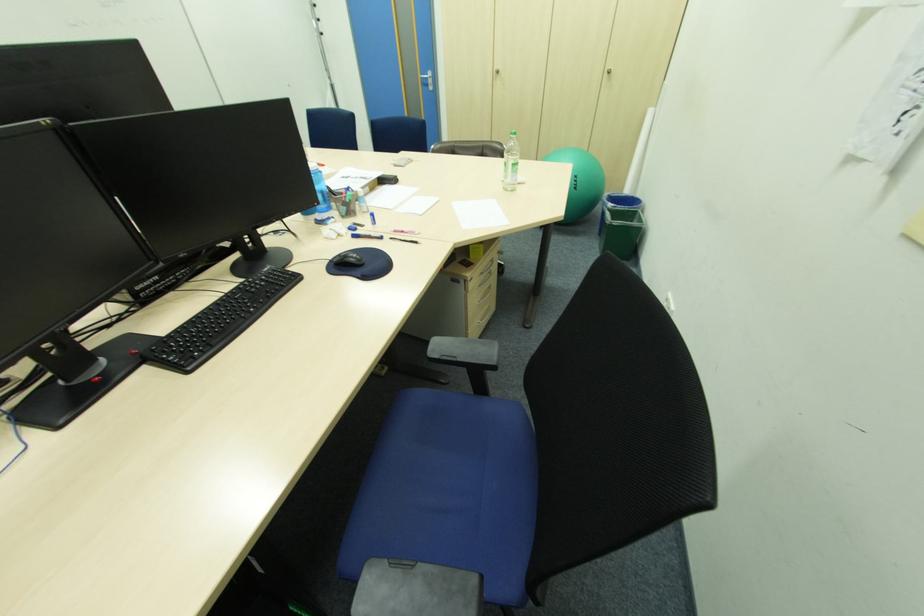
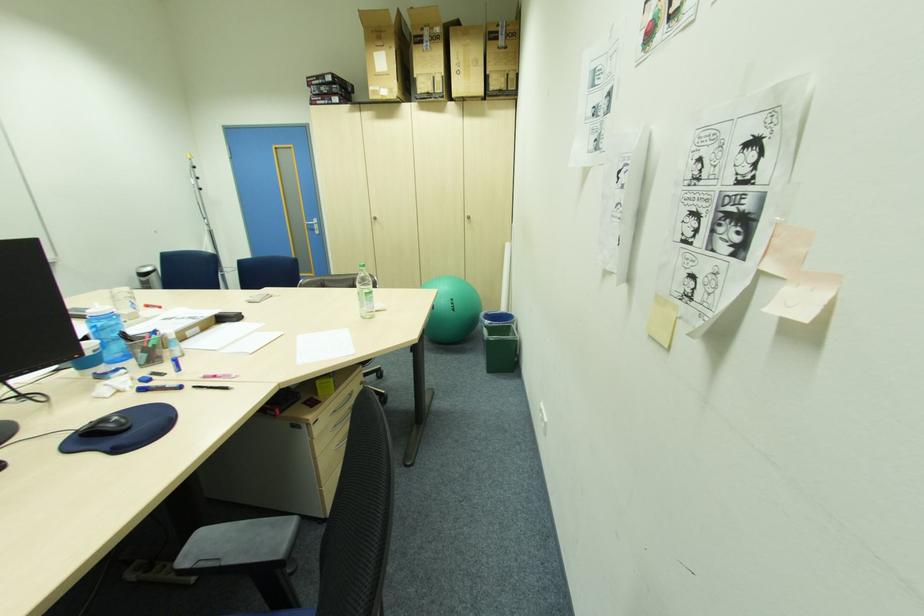
Question: The images are taken continuously from a first-person perspective. In which direction is your viewpoint rotating?

Choices:
 (A) Left
 (B) Right
 (C) Up
 (D) Down

Answer: (C)